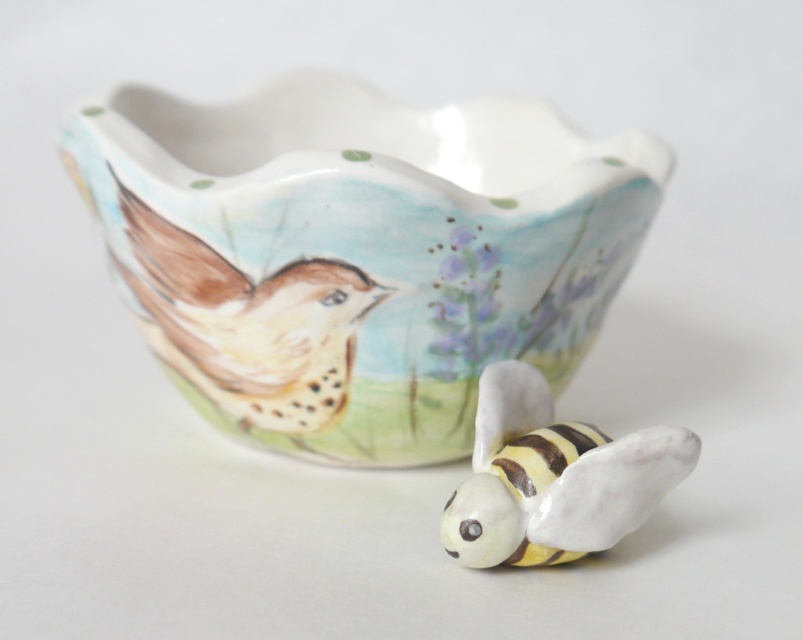
You are standing in front of the image and want to touch the point at coordinates point [123,157]. Can you reach it without moving your hand more than 1.2 meters from your body?

The point [123,157] is 1.23 meters from viewer, so no, you cannot reach it without moving your hand more than 1.2 meters from your body since it is slightly farther away.